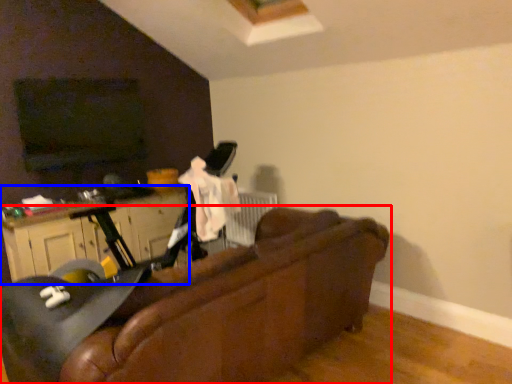
Question: Which object is further to the camera taking this photo, studio couch (highlighted by a red box) or dresser (highlighted by a blue box)?

Choices:
 (A) studio couch
 (B) dresser

Answer: (B)